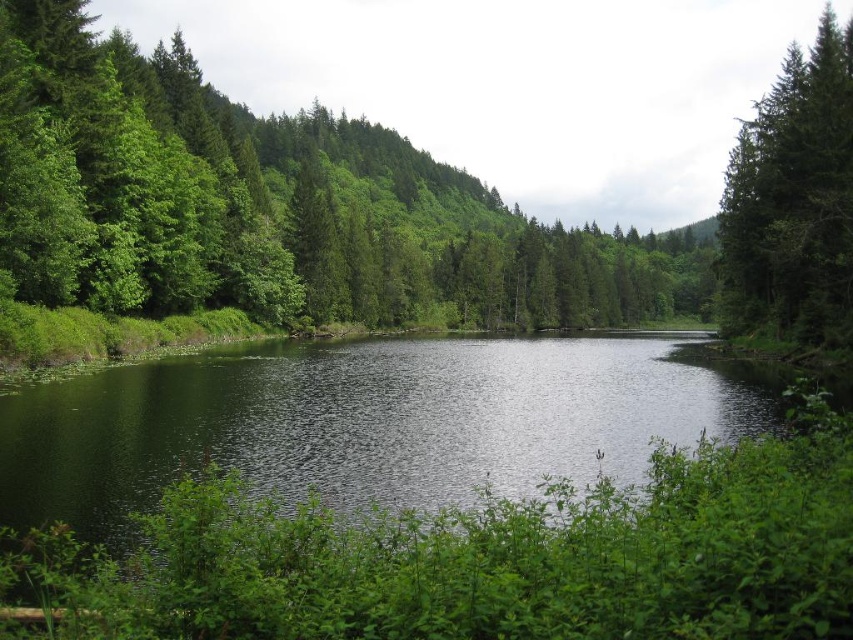
Which is more to the right, green smooth water at center or green matte tree at upper right?

green matte tree at upper right

Who is higher up, green smooth water at center or green matte tree at upper right?

green matte tree at upper right

Between point (200, 419) and point (850, 312), which one is positioned behind?

Point (850, 312)

This screenshot has height=640, width=853. I want to click on green smooth water at center, so click(x=369, y=420).

Which is below, green matte tree at center or green smooth water at center?

green smooth water at center is below.

The width and height of the screenshot is (853, 640). What do you see at coordinates (279, 205) in the screenshot? I see `green matte tree at center` at bounding box center [279, 205].

This screenshot has height=640, width=853. I want to click on green matte tree at center, so click(x=279, y=205).

Is point (506, 216) less distant than point (753, 227)?

No.

Where is `green matte tree at center`? green matte tree at center is located at coordinates (279, 205).

Locate an element on the screen. The height and width of the screenshot is (640, 853). green matte tree at center is located at coordinates (279, 205).